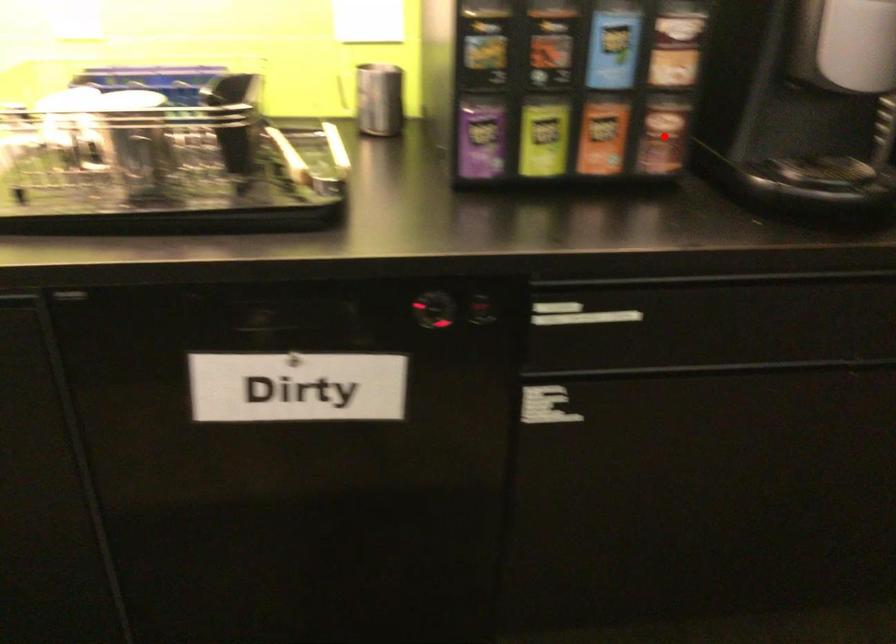
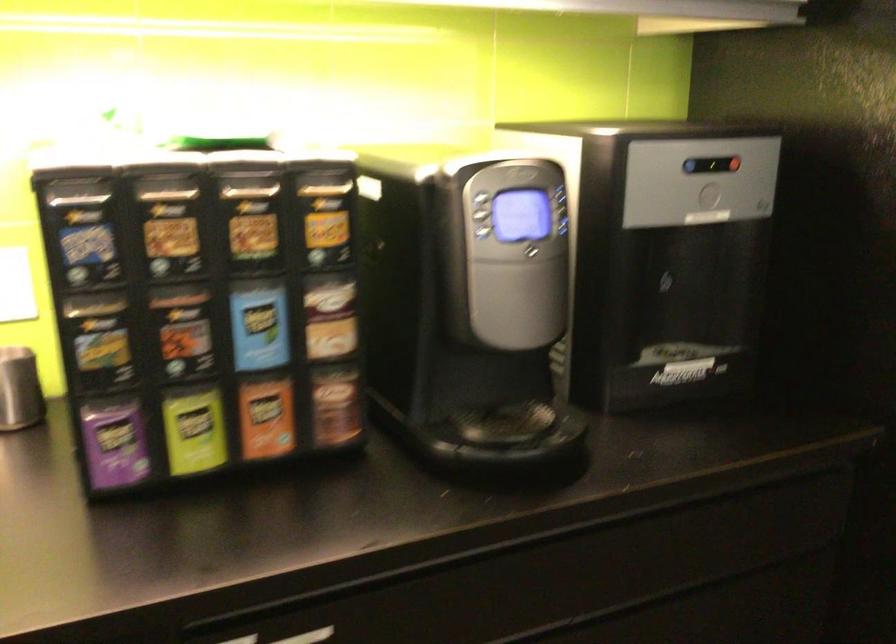
Locate, in the second image, the point that corresponds to the highlighted location in the first image.

(336, 406)